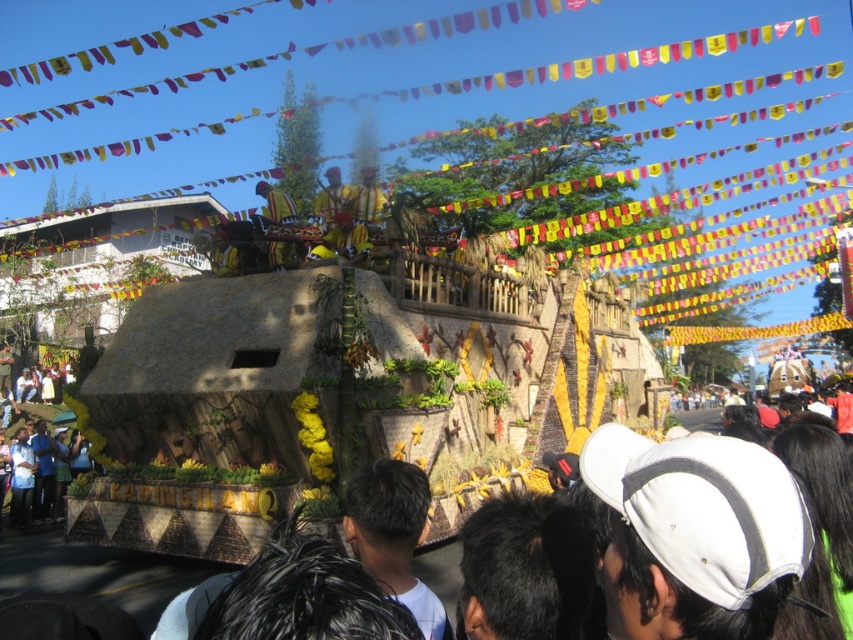
You are a photographer at the parade. You want to capture a photo where the black hair at center is visible above the wooden figure at center. Can you adjust your position or angle to achieve this?

The black hair at center is currently below the wooden figure at center, so adjusting your position or angle might allow you to capture the black hair at center above the wooden figure at center by positioning yourself lower or moving to a side angle where the wooden figure at center is not obstructing the view.

You are a photographer at the parade and want to capture both the black hair at center and the wooden figure at center in a single frame. Given their sizes, which object should you focus on to ensure both fit in the photo without cropping?

Since the black hair at center is narrower than the wooden figure at center, you should focus on the wooden figure at center to ensure both fit in the photo without cropping.